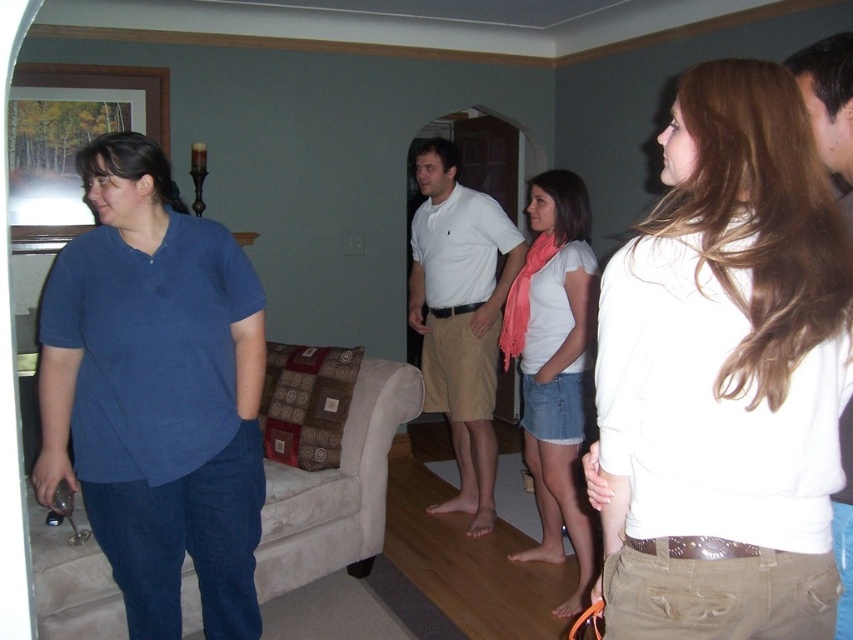
Between matte blue shirt at left and smooth beige shorts at center, which one has less height?

smooth beige shorts at center

Based on the photo, can you confirm if matte blue shirt at left is positioned to the right of smooth beige shorts at center?

In fact, matte blue shirt at left is to the left of smooth beige shorts at center.

This screenshot has width=853, height=640. Describe the element at coordinates (155, 392) in the screenshot. I see `matte blue shirt at left` at that location.

Locate an element on the screen. This screenshot has height=640, width=853. matte blue shirt at left is located at coordinates (155, 392).

Is matte blue shirt at left wider than white cotton polo shirt at center?

Correct, the width of matte blue shirt at left exceeds that of white cotton polo shirt at center.

Is point (236, 496) positioned behind point (477, 435)?

That is False.

Measure the distance between point (93,340) and camera.

Point (93,340) is 6.25 feet away from camera.

This screenshot has width=853, height=640. I want to click on matte blue shirt at left, so click(x=155, y=392).

Between point (656, 632) and point (468, 468), which one is positioned behind?

The point (468, 468) is more distant.

Between white matte shirt at upper right and white cotton polo shirt at center, which one has more height?

With more height is white cotton polo shirt at center.

What do you see at coordinates (726, 374) in the screenshot? I see `white matte shirt at upper right` at bounding box center [726, 374].

This screenshot has width=853, height=640. What are the coordinates of `white matte shirt at upper right` in the screenshot? It's located at (726, 374).